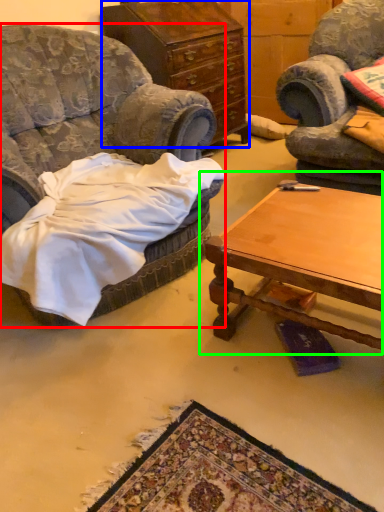
Question: Which object is the farthest from chair (highlighted by a red box)? Choose among these: cabinetry (highlighted by a blue box) or coffee table (highlighted by a green box).

Choices:
 (A) cabinetry
 (B) coffee table

Answer: (A)